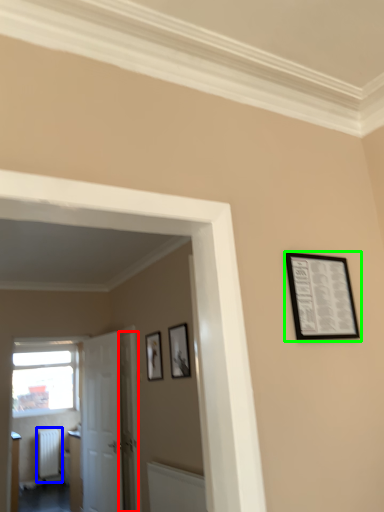
Question: Which is nearer to the door (highlighted by a red box)? radiator (highlighted by a blue box) or picture frame (highlighted by a green box).

Choices:
 (A) radiator
 (B) picture frame

Answer: (A)